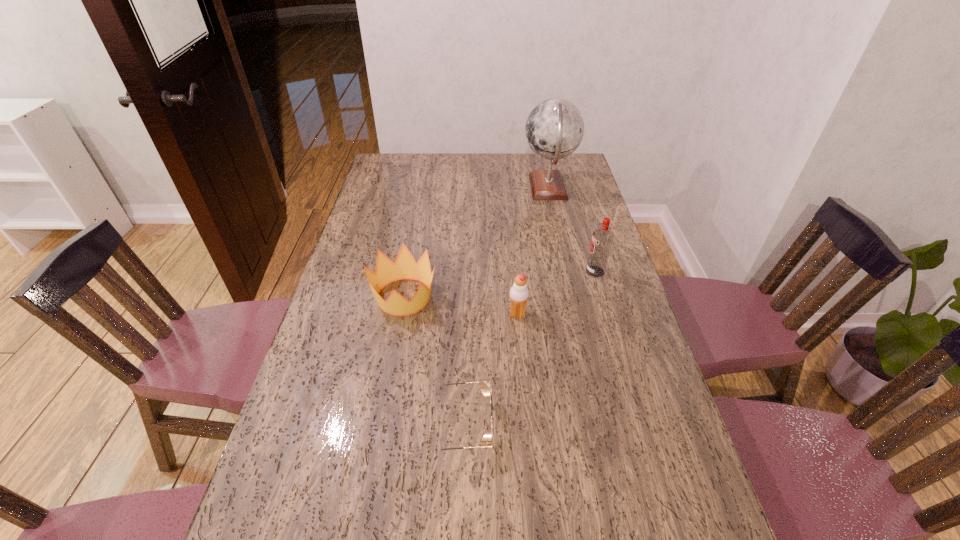
The width and height of the screenshot is (960, 540). I want to click on free space located 0.340m at the equator of the globe, so click(x=438, y=188).

This screenshot has height=540, width=960. Find the location of `vacant space located 0.330m at the equator of the globe`. vacant space located 0.330m at the equator of the globe is located at coordinates tap(440, 188).

What are the coordinates of `blank space located 0.350m on the front label of the vodka` in the screenshot? It's located at (476, 272).

Where is `vacant region located on the front label of the vodka`? vacant region located on the front label of the vodka is located at coordinates (532, 272).

Locate an element on the screen. This screenshot has height=540, width=960. free spot located on the front label of the vodka is located at coordinates (482, 272).

You are a GUI agent. You are given a task and a screenshot of the screen. Output one action in this format:
    pyautogui.click(x=<x>, y=<y>)
    Task: Click on the vacant area situated 0.050m at the front with a straw on the third object from left to right
    
    Given the screenshot: What is the action you would take?
    pyautogui.click(x=491, y=315)

Find the location of a particular element. The height and width of the screenshot is (540, 960). vacant space located at the front with a straw on the third object from left to right is located at coordinates (491, 315).

You are a GUI agent. You are given a task and a screenshot of the screen. Output one action in this format:
    pyautogui.click(x=<x>, y=<y>)
    Task: Click on the free space located at the front with a straw on the third object from left to right
    
    Given the screenshot: What is the action you would take?
    pyautogui.click(x=408, y=315)

You are a GUI agent. You are given a task and a screenshot of the screen. Output one action in this format:
    pyautogui.click(x=<x>, y=<y>)
    Task: Click on the free space located 0.390m on the right of the leftmost object
    
    Given the screenshot: What is the action you would take?
    pyautogui.click(x=567, y=296)

The image size is (960, 540). In order to click on vacant region located on the front lenses of the sunglasses in this screenshot , I will do `click(617, 425)`.